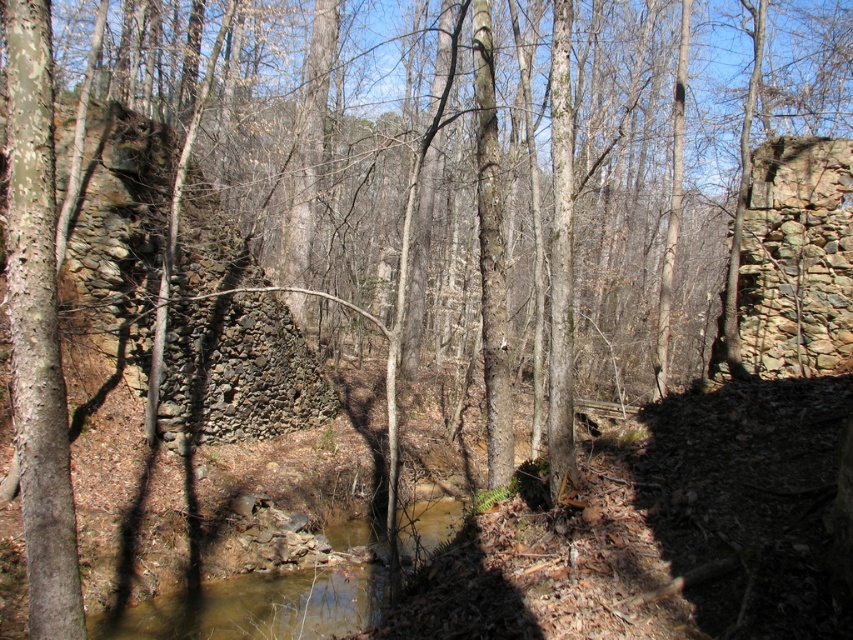
You are standing at the point labeled point (115, 333) and want to walk to the other side of the stream. The stream is 11.05 meters wide at this point. If your walking speed is 1.5 meters per second, how long will it take you to cross the stream?

The stream is 11.05 meters wide at this point. At a walking speed of 1.5 meters per second, it will take approximately 7.37 seconds to cross the stream.

You are a hiker who wants to cross the stream in the forest. You notice two stone walls on either side of the stream. Which wall is narrower, the dark gray stone wall at left or the rusty stone wall at right?

The dark gray stone wall at left has a lesser width compared to the rusty stone wall at right, so the dark gray stone wall at left is narrower.

You are a hiker who wants to cross the stream safely. You notice the dark gray stone wall at left and the rusty stone wall at right. Which wall should you step on first to cross the stream?

You should step on the dark gray stone wall at left first because it is positioned over the rusty stone wall at right, making it the higher and more stable surface for crossing.